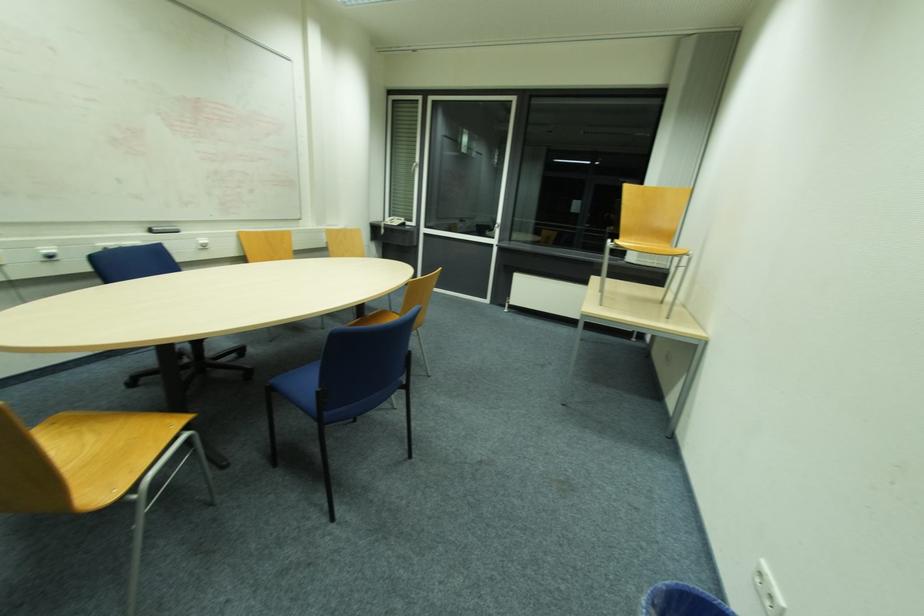
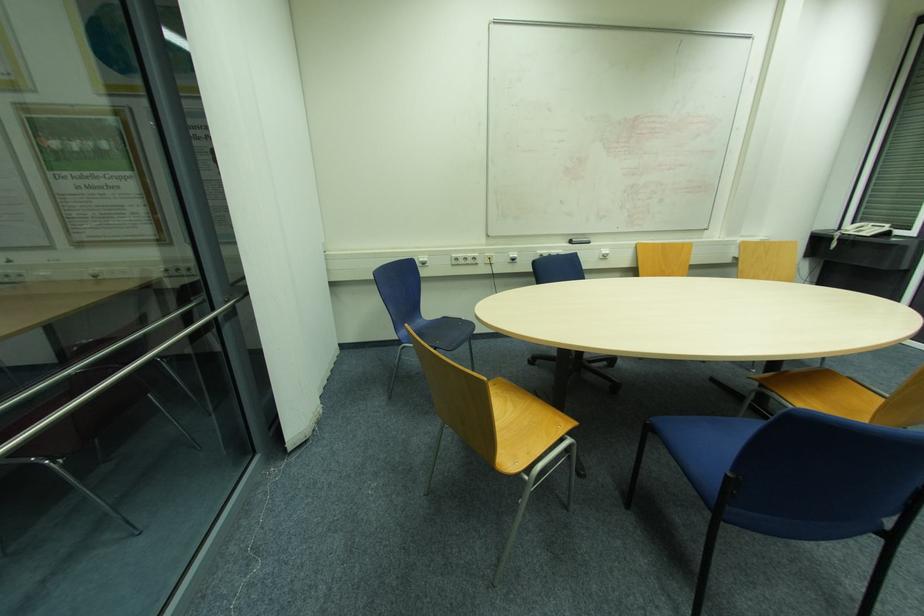
Find the pixel in the second image that matches pixel 203 243 in the first image.

(604, 253)